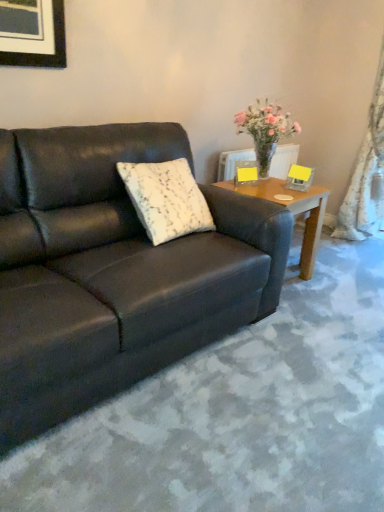
Locate an element on the screen. vacant space situated above wooden side table at right (from a real-world perspective) is located at coordinates (277, 189).